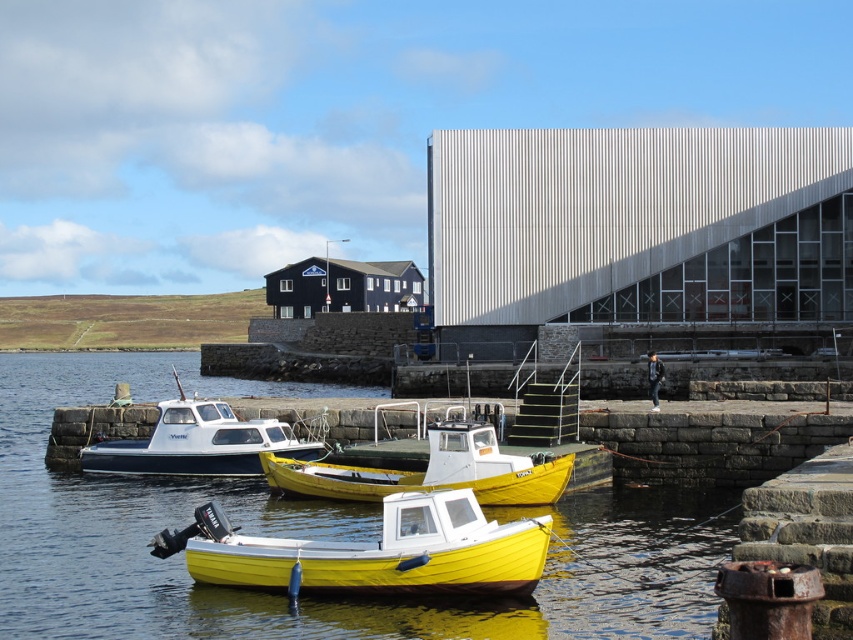
Is yellow matte boat at center below white plastic boat at center?

Indeed, yellow matte boat at center is positioned under white plastic boat at center.

Is point (546, 477) positioned in front of point (236, 413)?

Yes, point (546, 477) is in front of point (236, 413).

Between point (483, 464) and point (218, 460), which one is positioned in front?

Point (483, 464)

Locate an element on the screen. yellow matte boat at center is located at coordinates (433, 470).

Which is more to the right, yellow matte boat at lower center or yellow matte boat at center?

yellow matte boat at center is more to the right.

How far apart are yellow matte boat at lower center and yellow matte boat at center?

A distance of 8.56 meters exists between yellow matte boat at lower center and yellow matte boat at center.

What are the coordinates of `yellow matte boat at lower center` in the screenshot? It's located at (373, 552).

Is the position of yellow matte water at center less distant than that of yellow matte boat at lower center?

Yes, yellow matte water at center is closer to the viewer.

Does yellow matte water at center appear under yellow matte boat at lower center?

Incorrect, yellow matte water at center is not positioned below yellow matte boat at lower center.

Does point (347, 397) lie behind point (325, 557)?

Yes, point (347, 397) is farther from viewer.

This screenshot has width=853, height=640. What are the coordinates of `yellow matte water at center` in the screenshot? It's located at (305, 538).